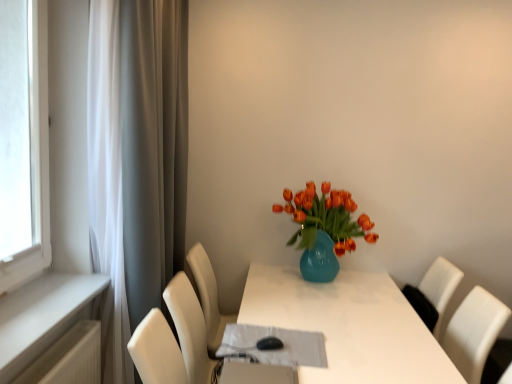
The image size is (512, 384). In order to click on free space below matte blue vase with orange tulips at center (from a real-world perspective) in this screenshot , I will do `click(318, 287)`.